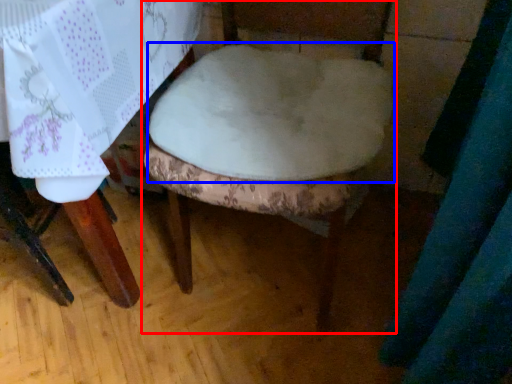
Question: Which object is further to the camera taking this photo, chair (highlighted by a red box) or round table (highlighted by a blue box)?

Choices:
 (A) chair
 (B) round table

Answer: (B)